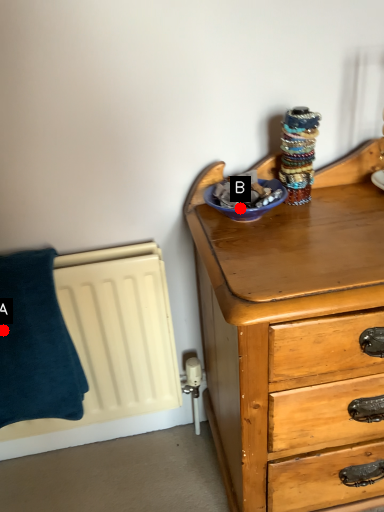
Question: Two points are circled on the image, labeled by A and B beside each circle. Which point appears farthest from the camera in this image?

Choices:
 (A) A is further
 (B) B is further

Answer: (A)